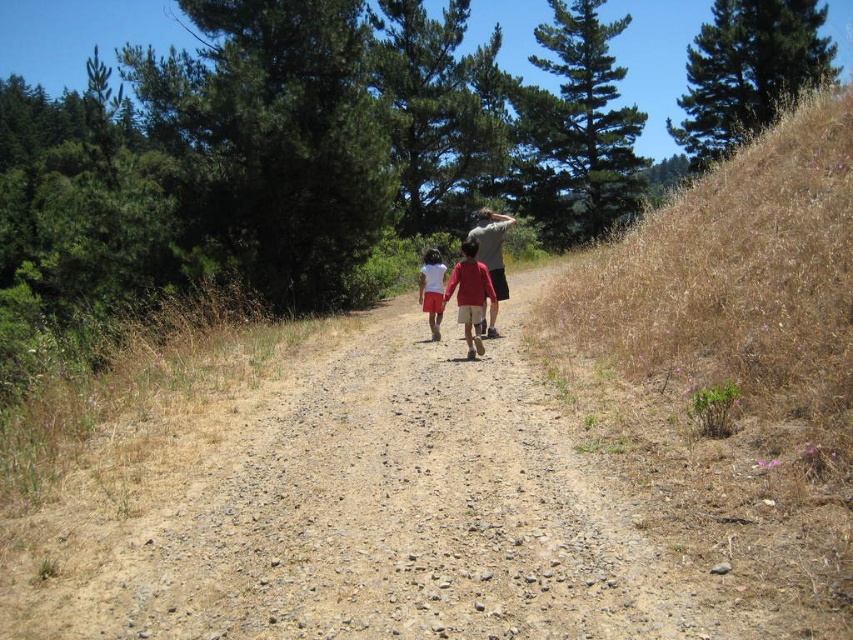
Question: Is matte red shirt at center thinner than white matte shorts at center?

Choices:
 (A) no
 (B) yes

Answer: (A)

Question: Can you confirm if matte red shirt at center is positioned below white matte shorts at center?

Choices:
 (A) no
 (B) yes

Answer: (B)

Question: Which object is positioned farthest from the matte red shirt at center?

Choices:
 (A) white matte shorts at center
 (B) matte gray shirt at center

Answer: (A)

Question: Is matte gray shirt at center smaller than white matte shorts at center?

Choices:
 (A) no
 (B) yes

Answer: (A)

Question: Estimate the real-world distances between objects in this image. Which object is closer to the matte red shirt at center?

Choices:
 (A) white matte shorts at center
 (B) matte gray shirt at center

Answer: (B)

Question: Which point appears farthest from the camera in this image?

Choices:
 (A) (437, 305)
 (B) (466, 355)
 (C) (469, 230)

Answer: (C)